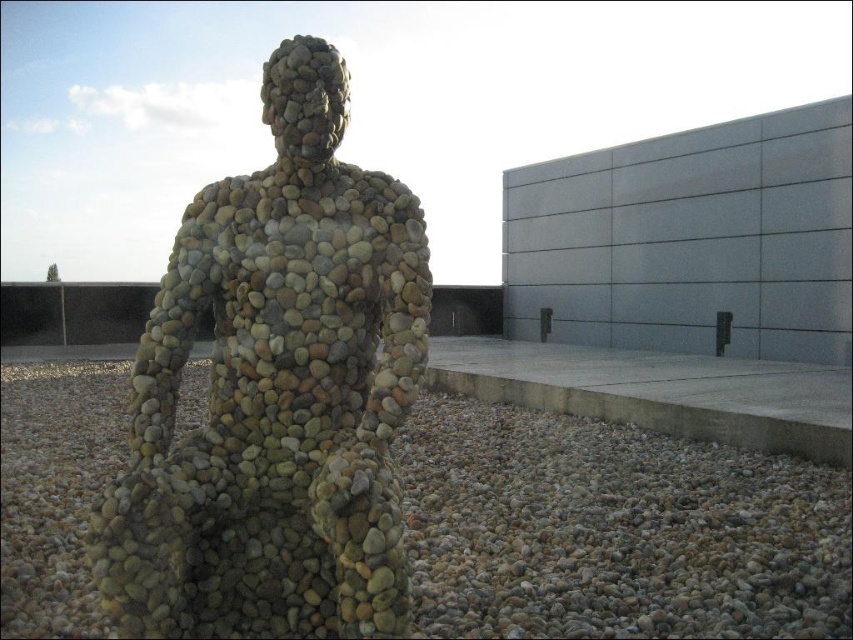
Question: Which point is farther from the camera taking this photo?

Choices:
 (A) (54, 435)
 (B) (149, 508)

Answer: (A)

Question: Which point is closer to the camera?

Choices:
 (A) smooth pebbles at center
 (B) multicolored pebble sculpture at center

Answer: (B)

Question: Can you confirm if multicolored pebble sculpture at center is thinner than smooth pebbles at center?

Choices:
 (A) yes
 (B) no

Answer: (A)

Question: Is multicolored pebble sculpture at center to the right of smooth pebbles at center from the viewer's perspective?

Choices:
 (A) yes
 (B) no

Answer: (B)

Question: Does multicolored pebble sculpture at center appear on the right side of smooth pebbles at center?

Choices:
 (A) yes
 (B) no

Answer: (B)